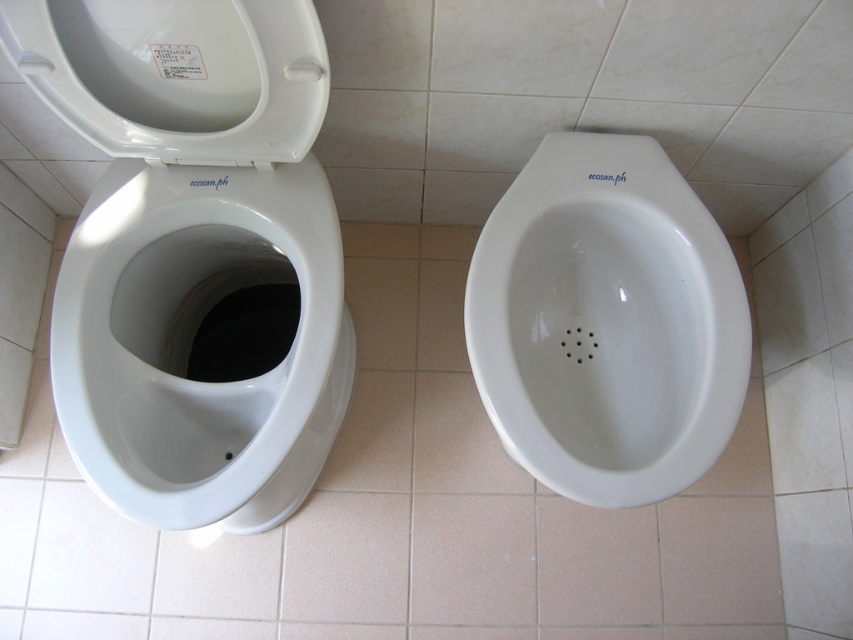
Which is more to the right, white glossy urinal at center or white glossy toilet lid at upper left?

white glossy urinal at center is more to the right.

I want to click on white glossy urinal at center, so click(607, 323).

The image size is (853, 640). In order to click on white glossy urinal at center in this screenshot , I will do `click(607, 323)`.

Which is above, white glossy toilet bowl at left or white glossy urinal at center?

Positioned higher is white glossy urinal at center.

Can you confirm if white glossy toilet bowl at left is positioned above white glossy urinal at center?

Actually, white glossy toilet bowl at left is below white glossy urinal at center.

Between point (183, 401) and point (689, 394), which one is positioned behind?

Positioned behind is point (183, 401).

Locate an element on the screen. Image resolution: width=853 pixels, height=640 pixels. white glossy toilet bowl at left is located at coordinates coord(192,342).

Can you confirm if white glossy toilet bowl at left is positioned to the left of white glossy toilet lid at upper left?

Indeed, white glossy toilet bowl at left is positioned on the left side of white glossy toilet lid at upper left.

Between point (119, 262) and point (277, 81), which one is positioned in front?

Point (277, 81)

You are a GUI agent. You are given a task and a screenshot of the screen. Output one action in this format:
    pyautogui.click(x=<x>, y=<y>)
    Task: Click on the white glossy toilet bowl at left
    The height and width of the screenshot is (640, 853).
    Given the screenshot: What is the action you would take?
    192,342